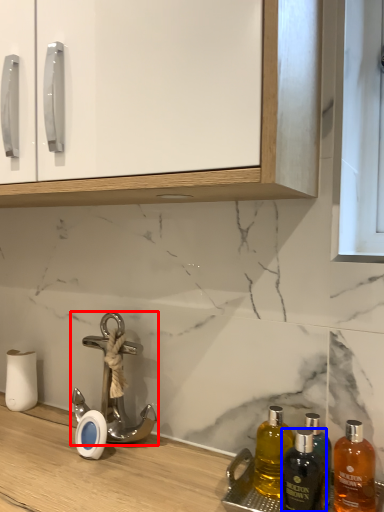
Question: Which of the following is the farthest to the observer, tap (highlighted by a red box) or bottle (highlighted by a blue box)?

Choices:
 (A) tap
 (B) bottle

Answer: (A)